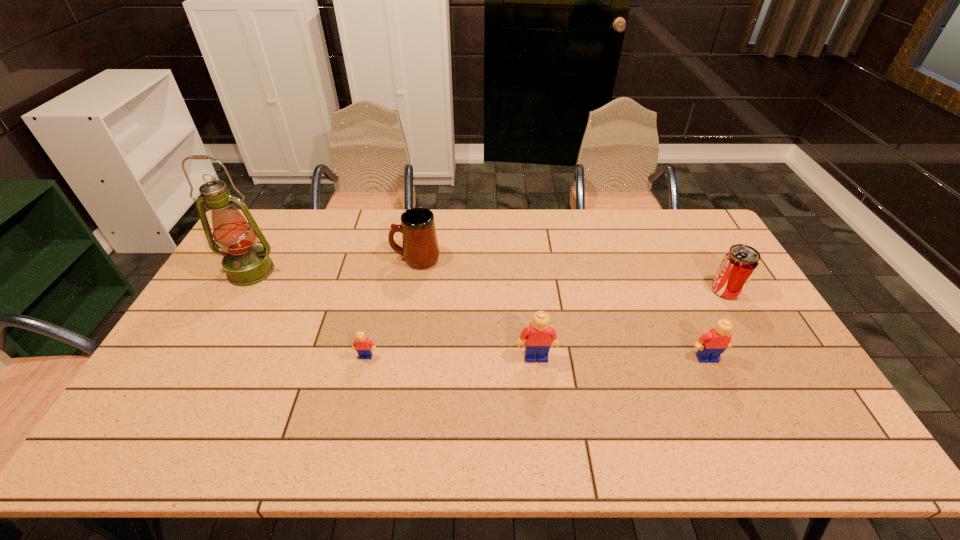
The Legos are evenly distributed in the image. To maintain this, where would you place another Lego on the left? Please point to a free space. Please provide its 2D coordinates. Your answer should be formatted as a tuple, i.e. [(x, y)], where the tuple contains the x and y coordinates of a point satisfying the conditions above.

[(197, 355)]